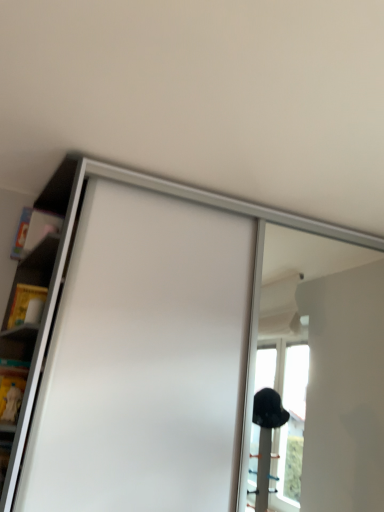
Question: Looking at their shapes, would you say white matte sliding door at center is wider or thinner than white glossy shelf at upper left?

Choices:
 (A) wide
 (B) thin

Answer: (A)

Question: From the image's perspective, relative to white glossy shelf at upper left, is white matte sliding door at center above or below?

Choices:
 (A) above
 (B) below

Answer: (B)

Question: In terms of size, does white matte sliding door at center appear bigger or smaller than white glossy shelf at upper left?

Choices:
 (A) small
 (B) big

Answer: (B)

Question: From a real-world perspective, is white glossy shelf at upper left positioned above or below white matte sliding door at center?

Choices:
 (A) below
 (B) above

Answer: (B)

Question: Is white glossy shelf at upper left inside or outside of white matte sliding door at center?

Choices:
 (A) inside
 (B) outside

Answer: (B)

Question: Would you say white glossy shelf at upper left is to the left or to the right of white matte sliding door at center in the picture?

Choices:
 (A) left
 (B) right

Answer: (A)

Question: Is point (44, 200) positioned closer to the camera than point (44, 374)?

Choices:
 (A) closer
 (B) farther

Answer: (B)